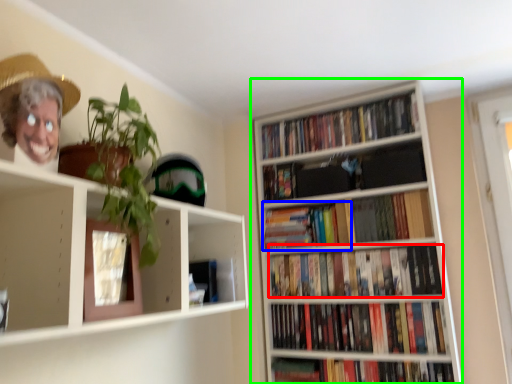
Question: Considering the real-world distances, which object is farthest from book (highlighted by a red box)? book (highlighted by a blue box) or bookcase (highlighted by a green box)?

Choices:
 (A) book
 (B) bookcase

Answer: (B)